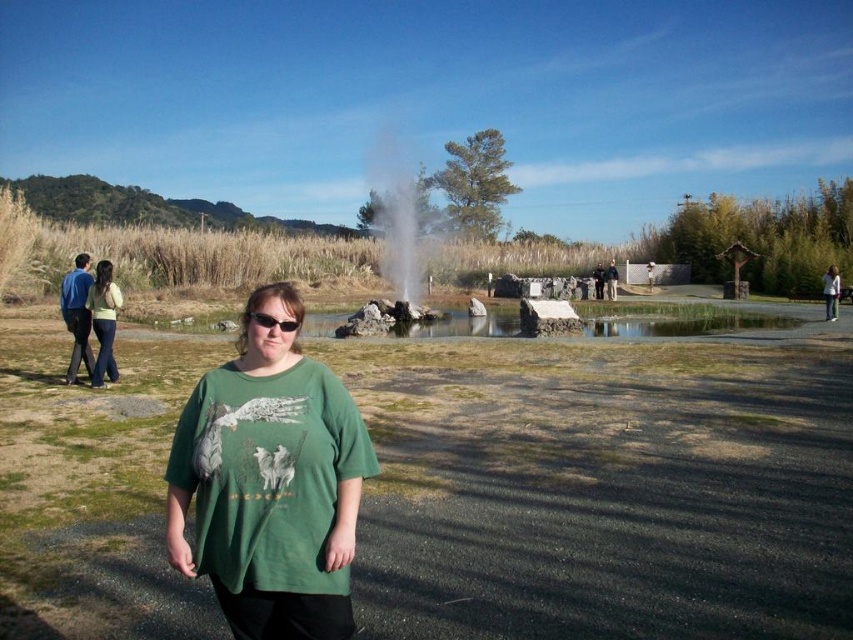
Can you confirm if green fabric park at center is positioned to the right of white smoke at center?

Yes, green fabric park at center is to the right of white smoke at center.

Does green fabric park at center appear on the left side of white smoke at center?

In fact, green fabric park at center is to the right of white smoke at center.

Who is more distant from viewer, (473, 461) or (410, 166)?

The point (410, 166) is more distant.

Find the location of a particular element. green fabric park at center is located at coordinates (602, 488).

Is black plastic sunglasses at center thinner than dark gray uniform at center?

Yes, black plastic sunglasses at center is thinner than dark gray uniform at center.

Which of these two, black plastic sunglasses at center or dark gray uniform at center, stands shorter?

black plastic sunglasses at center is shorter.

At what (x,y) coordinates should I click in order to perform the action: click on black plastic sunglasses at center. Please return your answer as a coordinate pair (x, y). Looking at the image, I should click on (273, 321).

Identify the location of black plastic sunglasses at center. Image resolution: width=853 pixels, height=640 pixels. (273, 321).

Which is above, clear stone pond at center or matte black jacket at center?

Positioned higher is matte black jacket at center.

Can you confirm if clear stone pond at center is shorter than matte black jacket at center?

Correct, clear stone pond at center is not as tall as matte black jacket at center.

This screenshot has height=640, width=853. Describe the element at coordinates (677, 321) in the screenshot. I see `clear stone pond at center` at that location.

Identify the location of clear stone pond at center. Image resolution: width=853 pixels, height=640 pixels. pyautogui.click(x=677, y=321).